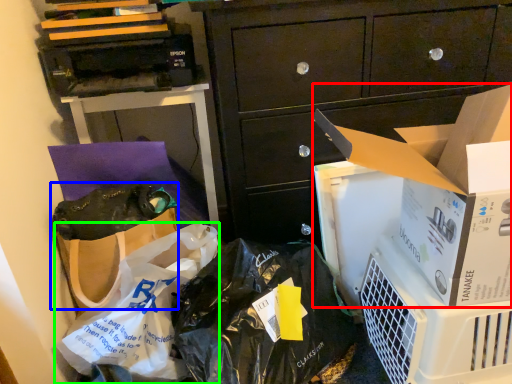
Question: Estimate the real-world distances between objects in this image. Which object is farther from cardboard box (highlighted by a red box), handbag (highlighted by a blue box) or plastic bag (highlighted by a green box)?

Choices:
 (A) handbag
 (B) plastic bag

Answer: (A)